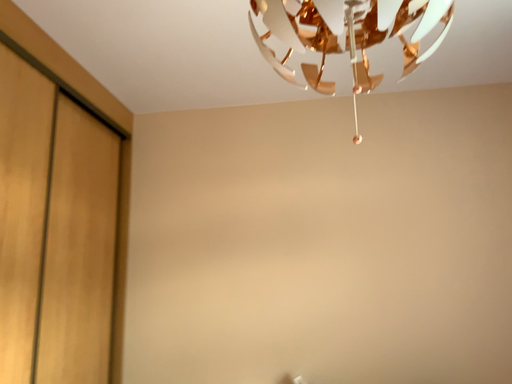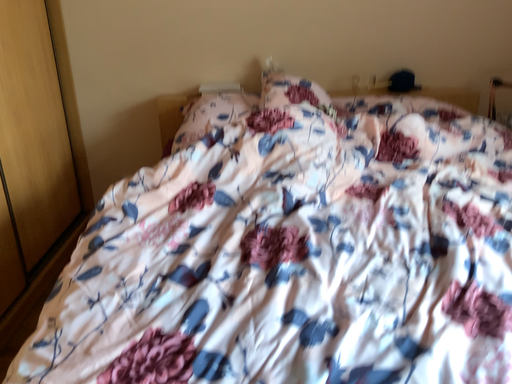
Question: Which way did the camera rotate in the video?

Choices:
 (A) rotated left
 (B) rotated right

Answer: (B)